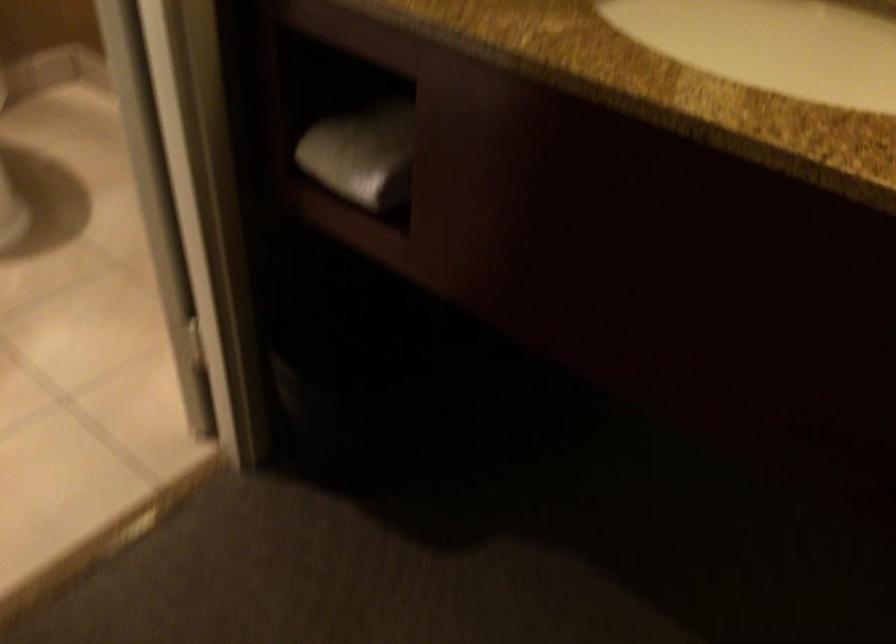
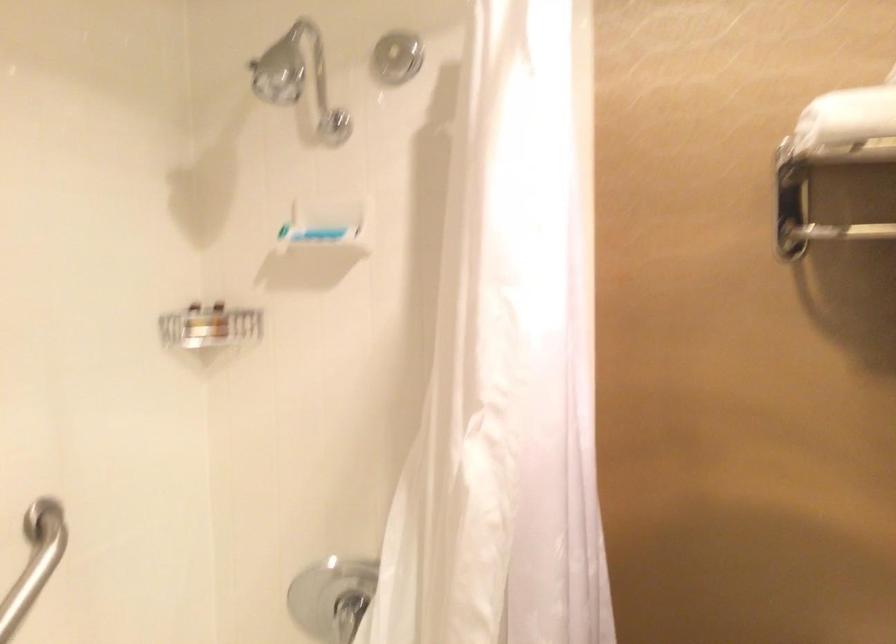
Question: The images are taken continuously from a first-person perspective. In which direction is your viewpoint rotating?

Choices:
 (A) Left
 (B) Right
 (C) Up
 (D) Down

Answer: (A)